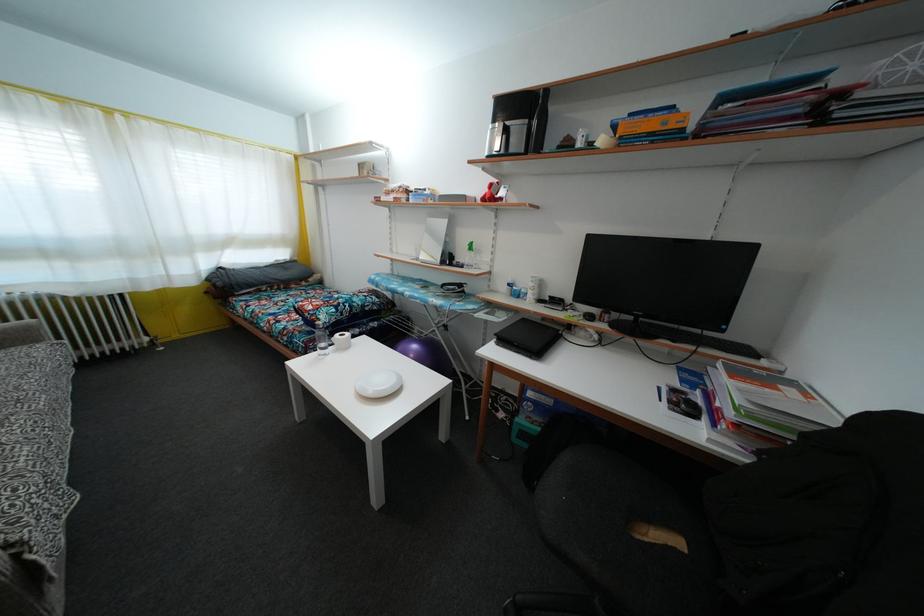
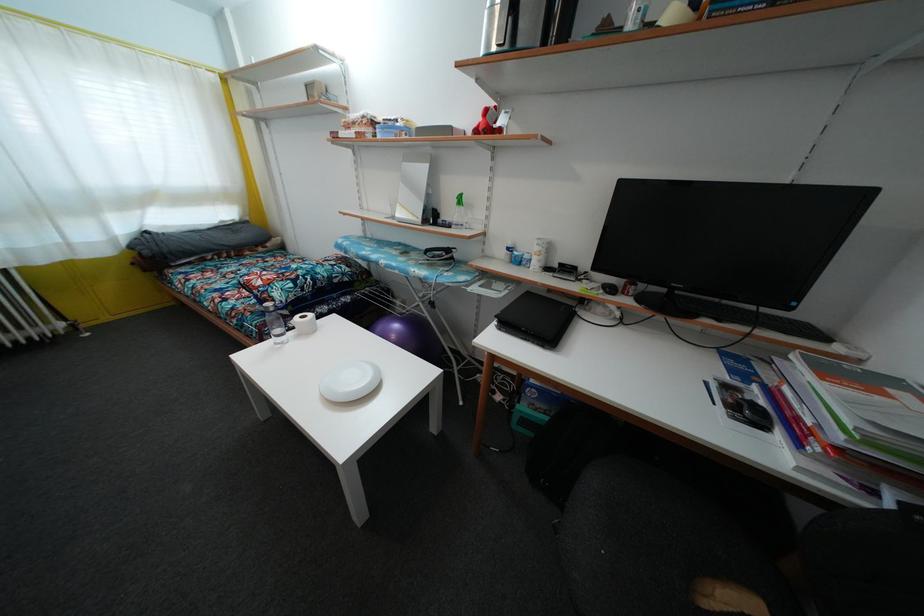
Question: How did the camera likely rotate?

Choices:
 (A) Left
 (B) Right
 (C) Up
 (D) Down

Answer: (D)